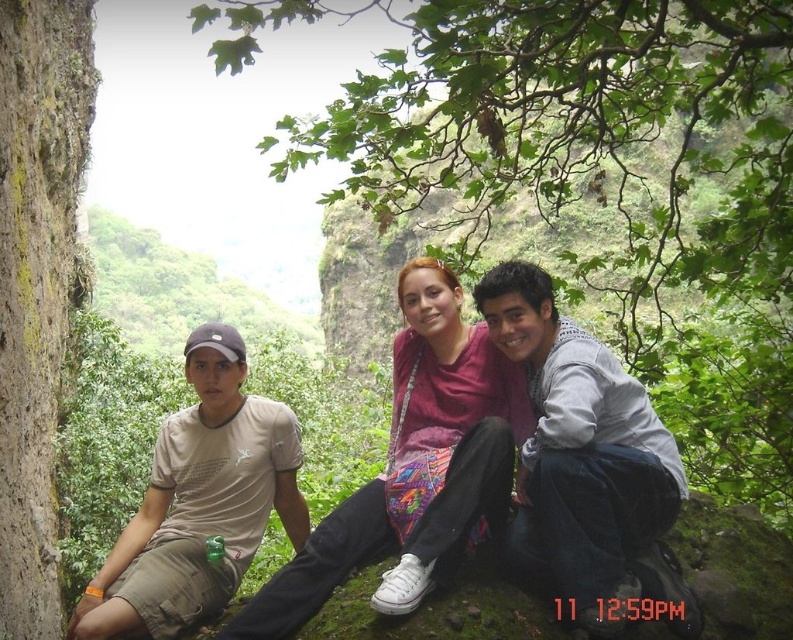
You are standing at the origin of the coordinate system in the image. You see a matte pink shirt at center located at point (412, 467). If you move 0.2 units to the right along the x axis, will you be closer to the matte pink shirt at center?

Moving 0.2 units to the right along the x axis from the origin would place you at point 0.2, 0.0. The distance to the matte pink shirt at center at (412, 467) would increase since you are moving away in both x and y directions. Therefore, you would be farther from the matte pink shirt at center.